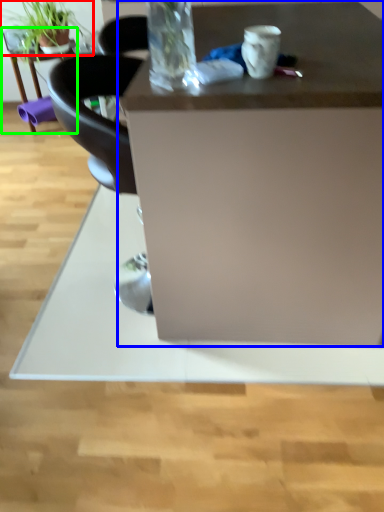
Question: Based on their relative distances, which object is nearer to houseplant (highlighted by a red box)? Choose from desk (highlighted by a blue box) and table (highlighted by a green box).

Choices:
 (A) desk
 (B) table

Answer: (B)